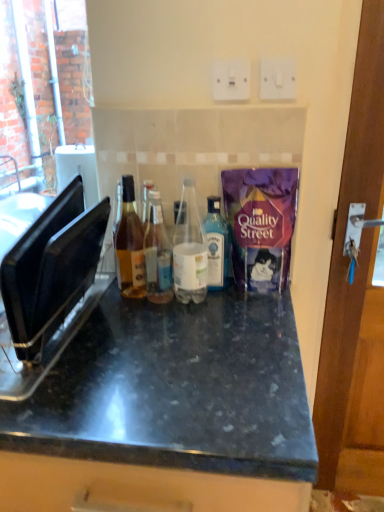
In order to click on vacant space in front of black plastic toaster at left in this screenshot , I will do `click(92, 391)`.